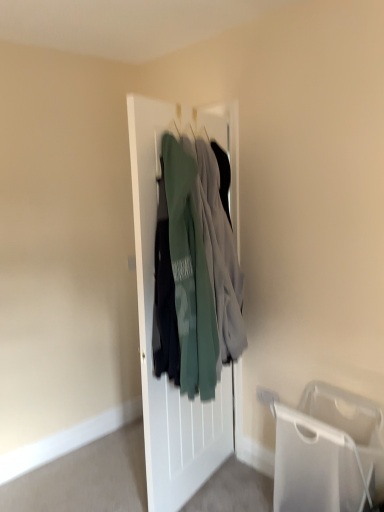
The height and width of the screenshot is (512, 384). What do you see at coordinates (151, 329) in the screenshot?
I see `white matte door at center` at bounding box center [151, 329].

Locate an element on the screen. This screenshot has height=512, width=384. white matte door at center is located at coordinates (151, 329).

You are a GUI agent. You are given a task and a screenshot of the screen. Output one action in this format:
    pyautogui.click(x=<x>, y=<y>)
    Task: Click on the white matte door at center
    The image size is (384, 512).
    Given the screenshot: What is the action you would take?
    pos(151,329)